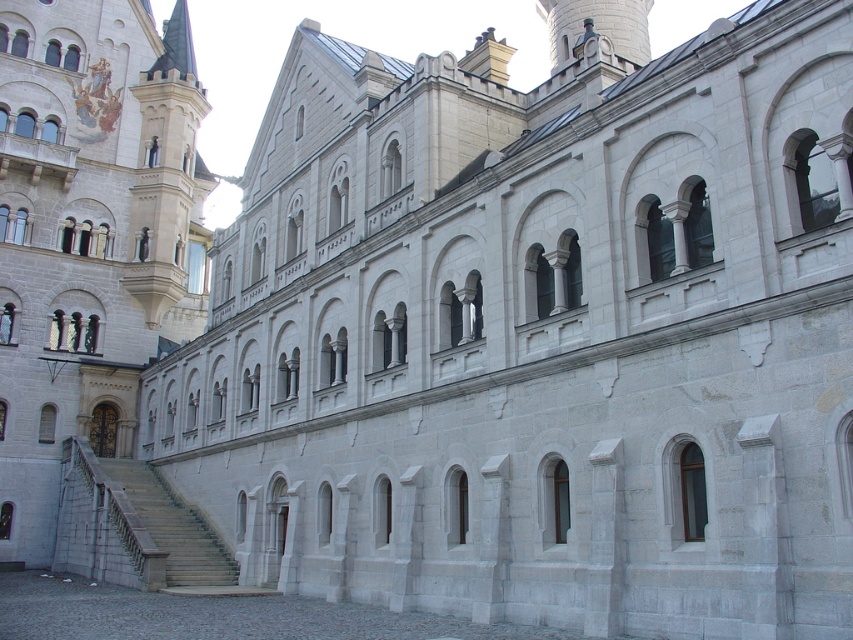
Question: Which point is closer to the camera?

Choices:
 (A) (4, 168)
 (B) (134, 499)

Answer: (B)

Question: Which of the following is the farthest from the observer?

Choices:
 (A) light gray stone staircase at lower left
 (B) gray stone stairs at lower left

Answer: (A)

Question: Does light gray stone staircase at lower left have a larger size compared to gray stone stairs at lower left?

Choices:
 (A) no
 (B) yes

Answer: (B)

Question: Observing the image, what is the correct spatial positioning of light gray stone staircase at lower left in reference to gray stone stairs at lower left?

Choices:
 (A) above
 (B) below

Answer: (A)

Question: Which object appears closest to the camera in this image?

Choices:
 (A) gray stone stairs at lower left
 (B) light gray stone staircase at lower left

Answer: (A)

Question: Can you confirm if light gray stone staircase at lower left is thinner than gray stone stairs at lower left?

Choices:
 (A) yes
 (B) no

Answer: (A)